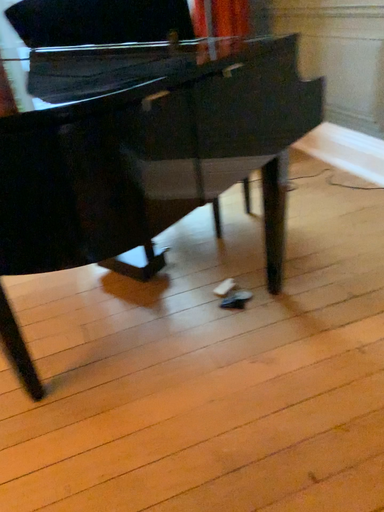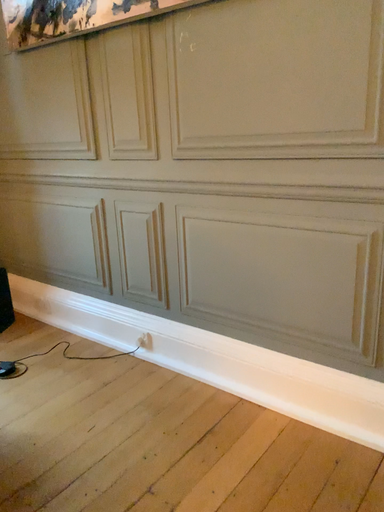
Question: Which way did the camera rotate in the video?

Choices:
 (A) rotated left
 (B) rotated right

Answer: (B)